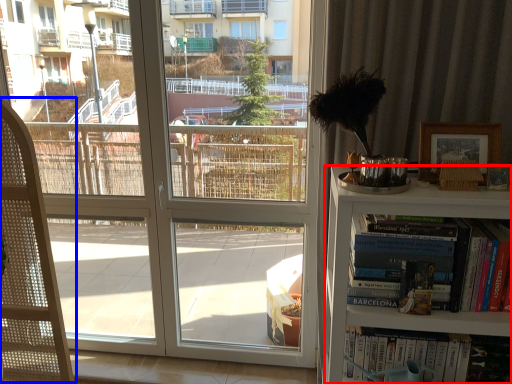
Question: Which object appears closest to the camera in this image, bookcase (highlighted by a red box) or folding chair (highlighted by a blue box)?

Choices:
 (A) bookcase
 (B) folding chair

Answer: (A)